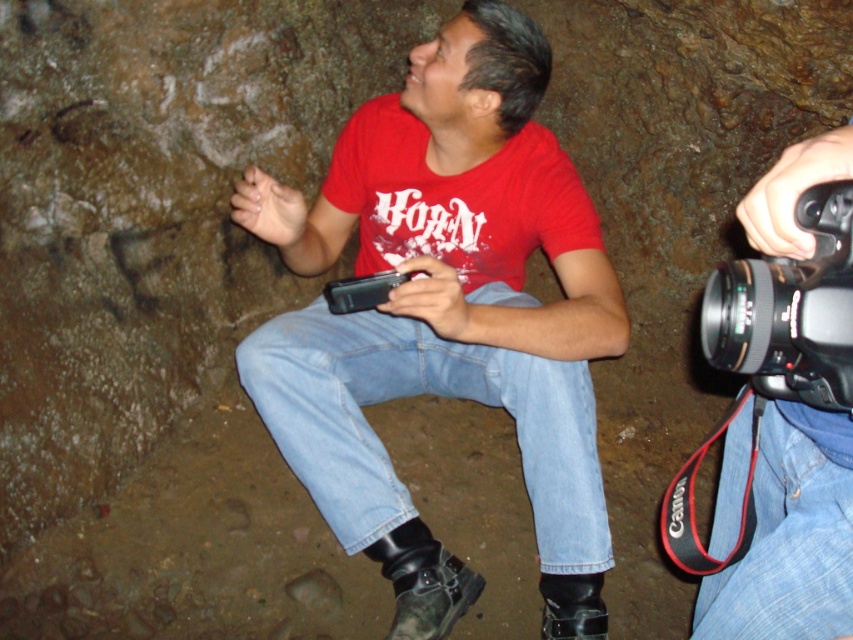
Is point (252, 396) closer to camera compared to point (306, 353)?

No, it is behind (306, 353).

Is matte red t-shirt at center thinner than blue denim jeans at center?

Incorrect, matte red t-shirt at center's width is not less than blue denim jeans at center's.

Measure the distance between matte red t-shirt at center and camera.

The distance of matte red t-shirt at center from camera is 5.20 feet.

The image size is (853, 640). Identify the location of matte red t-shirt at center. (445, 316).

Is point (498, 19) closer to viewer compared to point (790, 561)?

No, (498, 19) is further to viewer.

Is matte red t-shirt at center wider than blue denim jeans at lower right?

Correct, the width of matte red t-shirt at center exceeds that of blue denim jeans at lower right.

Is point (257, 369) behind point (735, 618)?

Yes, it is behind point (735, 618).

Locate an element on the screen. matte red t-shirt at center is located at coordinates (445, 316).

Does blue denim jeans at center appear under black plastic camera at right?

Yes.

Does blue denim jeans at center appear on the right side of black plastic camera at right?

In fact, blue denim jeans at center is to the left of black plastic camera at right.

Does point (305, 348) come behind point (840, 202)?

Yes, it is.

At what (x,y) coordinates should I click in order to perform the action: click on blue denim jeans at center. Please return your answer as a coordinate pair (x, y). The height and width of the screenshot is (640, 853). Looking at the image, I should click on (416, 394).